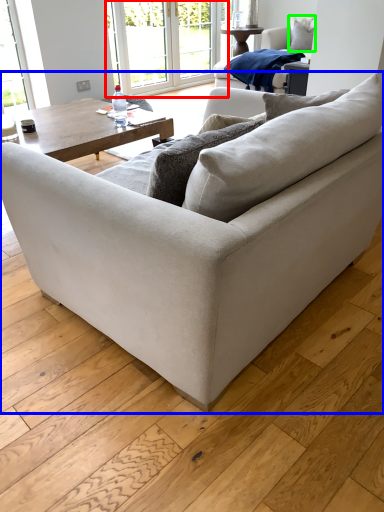
Question: Which object is the closest to the window frame (highlighted by a red box)? Choose among these: studio couch (highlighted by a blue box) or pillow (highlighted by a green box).

Choices:
 (A) studio couch
 (B) pillow

Answer: (B)